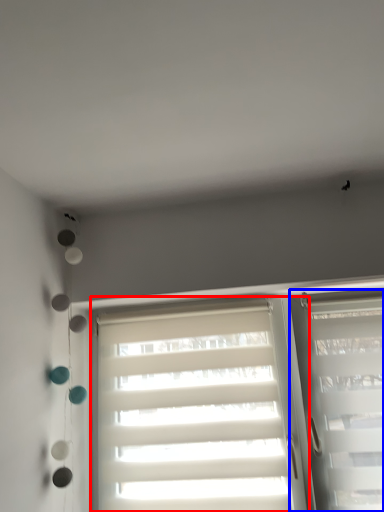
Question: Which object is further to the camera taking this photo, window (highlighted by a red box) or window (highlighted by a blue box)?

Choices:
 (A) window
 (B) window

Answer: (A)